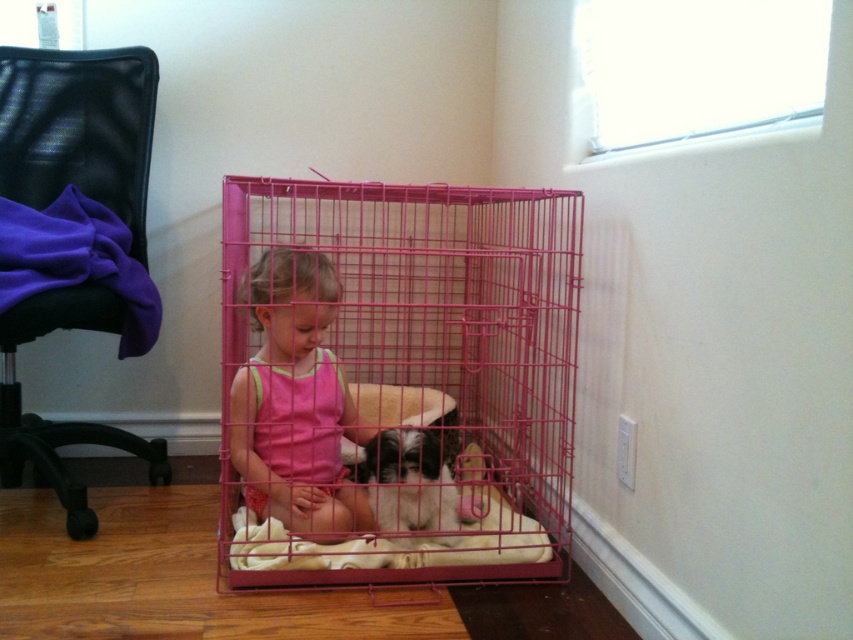
Consider the image. Which is above, pink fabric child at center or soft beige cushion at center?

Positioned higher is pink fabric child at center.

Does pink fabric child at center have a smaller size compared to soft beige cushion at center?

Indeed, pink fabric child at center has a smaller size compared to soft beige cushion at center.

Which is in front, point (262, 476) or point (422, 410)?

Point (262, 476) is more forward.

Locate an element on the screen. The height and width of the screenshot is (640, 853). pink fabric child at center is located at coordinates (294, 401).

Between pink wire cage at center and black and white fur at center, which one has less height?

black and white fur at center is shorter.

Is pink wire cage at center thinner than black and white fur at center?

In fact, pink wire cage at center might be wider than black and white fur at center.

This screenshot has height=640, width=853. Describe the element at coordinates (396, 372) in the screenshot. I see `pink wire cage at center` at that location.

This screenshot has height=640, width=853. What are the coordinates of `pink wire cage at center` in the screenshot? It's located at (396, 372).

Does soft beige cushion at center have a larger size compared to black and white fur at center?

Yes, soft beige cushion at center is bigger than black and white fur at center.

Is point (540, 556) farther from camera compared to point (368, 465)?

That is False.

This screenshot has width=853, height=640. Find the location of `soft beige cushion at center`. soft beige cushion at center is located at coordinates (393, 544).